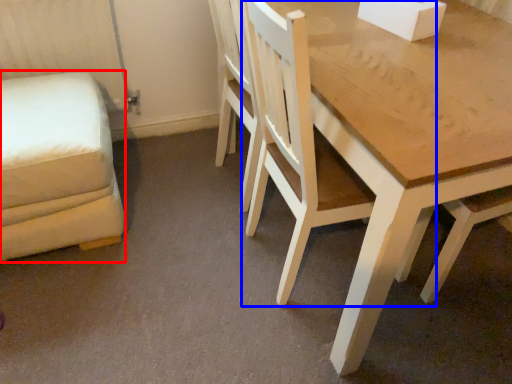
Question: Which object is closer to the camera taking this photo, swivel chair (highlighted by a red box) or chair (highlighted by a blue box)?

Choices:
 (A) swivel chair
 (B) chair

Answer: (B)